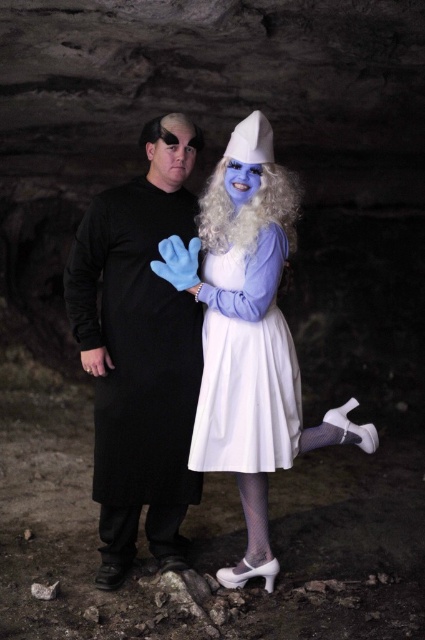
You are a photographer trying to capture the black matte coat at left in the image. According to the coordinates provided, where should you focus your camera to ensure the coat is centered in the frame?

The black matte coat at left is positioned at coordinates point (x=139, y=352), so you should focus your camera there to center it in the frame.

You are a photographer setting up a shoot in a cave. You have two props to place in the scene according to the image description. The black matte coat at left and the white satin dress at center. Based on their positions, which prop is closer to the ground?

The black matte coat at left is below the white satin dress at center, so the black matte coat at left is closer to the ground.

You are standing in a cave and want to move from the point at coordinates point (136, 426) to the point at coordinates point (207, 289). Given that the cave has narrow passages, which direction should you move to reach your destination?

To move from point (136, 426) to point (207, 289), you should move towards the front since point (136, 426) is behind point (207, 289).